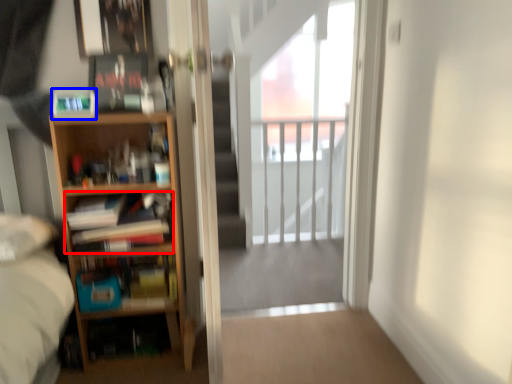
Question: Among these objects, which one is nearest to the camera, book (highlighted by a red box) or paperback book (highlighted by a blue box)?

Choices:
 (A) book
 (B) paperback book

Answer: (B)